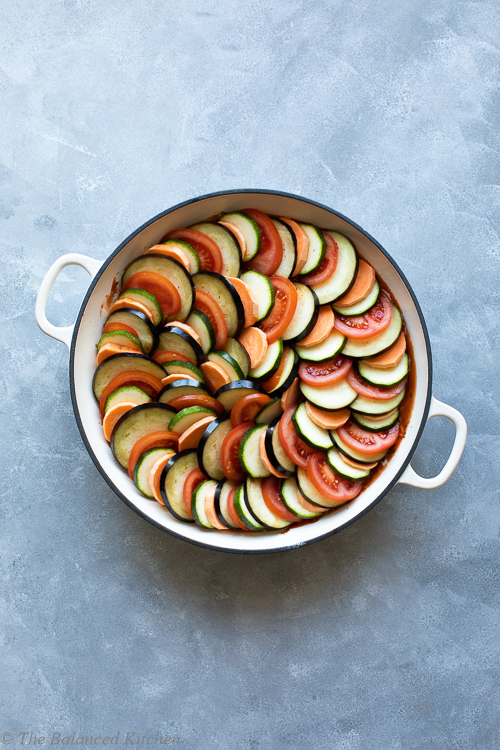
At what (x,y) coordinates should I click in order to perform the action: click on blue and white painted surface. Please return your answer as a coordinate pair (x, y). Image resolution: width=500 pixels, height=750 pixels. Looking at the image, I should click on (246, 645), (258, 86).